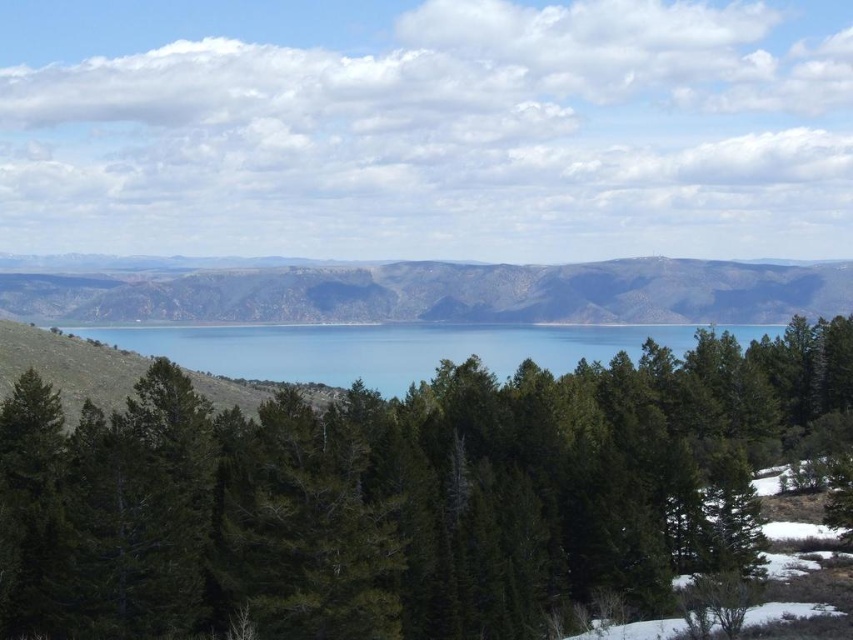
You are standing at the point labeled point [422,364] and want to walk towards the point labeled point [792,401]. Which direction should you face to move towards it?

You should face towards the lower right direction to move towards point [792,401] from point [422,364].

Consider the image. You are planning to take a photo of the brown rocky mountains at center and blue water at center from the foreground. Which object will occupy more horizontal space in your photo?

The brown rocky mountains at center will occupy more horizontal space in the photo because its width surpasses that of the blue water at center.

You are an environmental scientist studying the landscape. You observe the green matte tree at center and the brown rocky mountains at center. Which of these two objects has a smaller width when viewed from above?

The green matte tree at center is thinner than the brown rocky mountains at center, so the green matte tree at center has a smaller width when viewed from above.